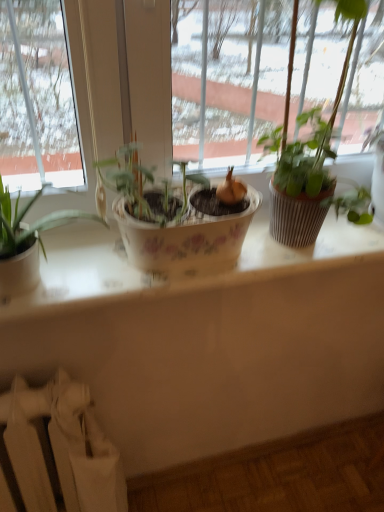
Question: Should I look upward or downward to see white fabric radiator at lower left?

Choices:
 (A) up
 (B) down

Answer: (B)

Question: Are green matte plant at upper right and white fabric radiator at lower left far apart?

Choices:
 (A) yes
 (B) no

Answer: (B)

Question: Is green matte plant at upper right wider than white fabric radiator at lower left?

Choices:
 (A) yes
 (B) no

Answer: (B)

Question: Is green matte plant at upper right shorter than white fabric radiator at lower left?

Choices:
 (A) yes
 (B) no

Answer: (A)

Question: Does green matte plant at upper right have a greater height compared to white fabric radiator at lower left?

Choices:
 (A) yes
 (B) no

Answer: (B)

Question: Is green matte plant at upper right bigger than white fabric radiator at lower left?

Choices:
 (A) yes
 (B) no

Answer: (B)

Question: Is green matte plant at upper right oriented away from white fabric radiator at lower left?

Choices:
 (A) no
 (B) yes

Answer: (A)

Question: Is white fabric radiator at lower left at the left side of green matte plant at upper right?

Choices:
 (A) no
 (B) yes

Answer: (B)

Question: Does white fabric radiator at lower left have a smaller size compared to green matte plant at upper right?

Choices:
 (A) yes
 (B) no

Answer: (B)

Question: Are white fabric radiator at lower left and green matte plant at upper right located far from each other?

Choices:
 (A) yes
 (B) no

Answer: (B)

Question: From a real-world perspective, is white fabric radiator at lower left on green matte plant at upper right?

Choices:
 (A) yes
 (B) no

Answer: (B)

Question: Can you confirm if white fabric radiator at lower left is positioned to the right of green matte plant at upper right?

Choices:
 (A) no
 (B) yes

Answer: (A)

Question: From the image's perspective, is white fabric radiator at lower left beneath green matte plant at upper right?

Choices:
 (A) no
 (B) yes

Answer: (B)

Question: Considering their positions, is white fabric radiator at lower left located in front of or behind green matte plant at upper right?

Choices:
 (A) behind
 (B) front

Answer: (A)